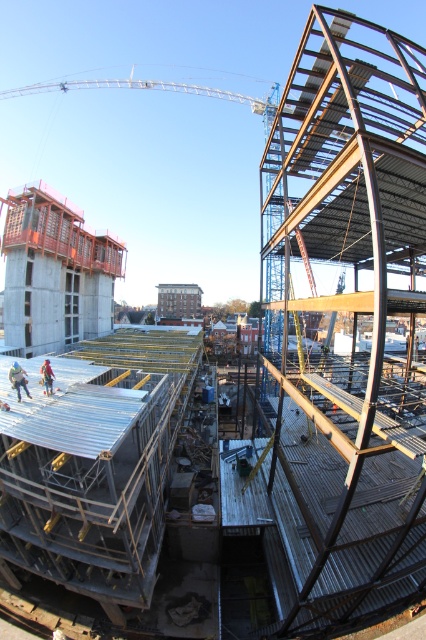
You are a safety inspector standing at the center of the construction site. You need to locate the blue jeans construction worker at lower left. According to the coordinates provided, where exactly should you look to find them?

The blue jeans construction worker at lower left is located at coordinates point (17,378), so you should look towards the lower left area of the site to find them.

You are a construction worker standing at the crane in the background of the construction site. You notice two points marked on the blueprint at coordinates point (x=11, y=369) and point (x=51, y=372). Which point is closer to your current position?

Point (x=11, y=369) is in front of point (x=51, y=372), so the point closer to your current position at the crane in the background is point (x=11, y=369).

You are a construction supervisor who needs to ensure safety protocols are followed. You observe the blue jeans construction worker at lower left and the orange safety vest at center. Can the supervisor safely walk between them without needing to step over any obstacles, given that the supervisor requires a minimum clearance of 14 inches?

The distance between the blue jeans construction worker at lower left and the orange safety vest at center is 15.38 inches, which exceeds the required 14 inches clearance. Therefore, the supervisor can safely walk between them without needing to step over any obstacles.